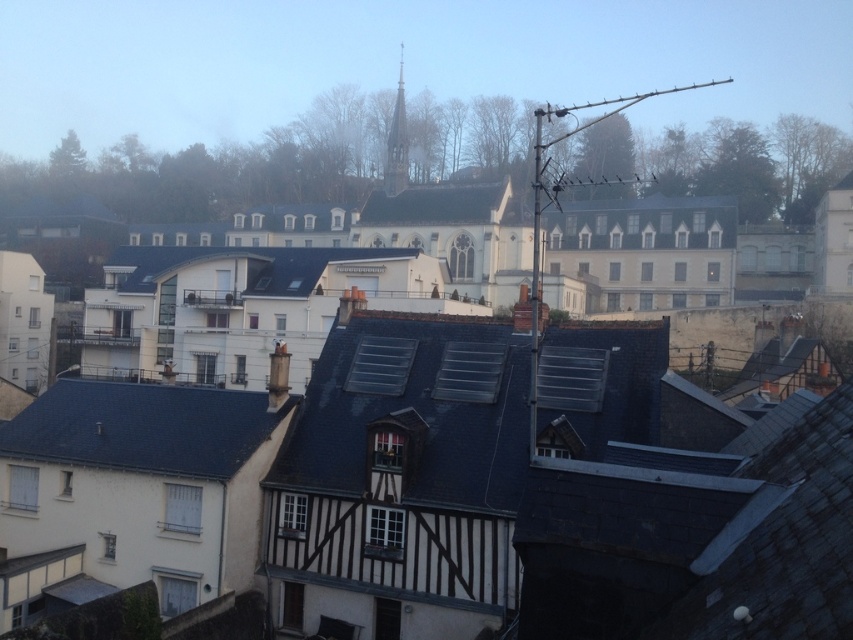
Is gray slate roof at center bigger than white shingled roof at center?

Yes.

Between gray slate roof at center and white shingled roof at center, which one has less height?

With less height is white shingled roof at center.

Does point (120, 273) come closer to viewer compared to point (453, 205)?

Yes, point (120, 273) is closer to viewer.

The height and width of the screenshot is (640, 853). I want to click on gray slate roof at center, so click(x=276, y=269).

Can you confirm if dark gray slate roof at lower left is taller than gray slate roof at center?

In fact, dark gray slate roof at lower left may be shorter than gray slate roof at center.

Between dark gray slate roof at lower left and gray slate roof at center, which one is positioned higher?

Positioned higher is gray slate roof at center.

This screenshot has width=853, height=640. What are the coordinates of `dark gray slate roof at lower left` in the screenshot? It's located at (142, 428).

Does dark gray slate roof at lower left have a smaller size compared to white shingled roof at center?

Yes.

Is point (248, 397) closer to camera compared to point (502, 196)?

That is True.

At what (x,y) coordinates should I click in order to perform the action: click on dark gray slate roof at lower left. Please return your answer as a coordinate pair (x, y). This screenshot has height=640, width=853. Looking at the image, I should click on pos(142,428).